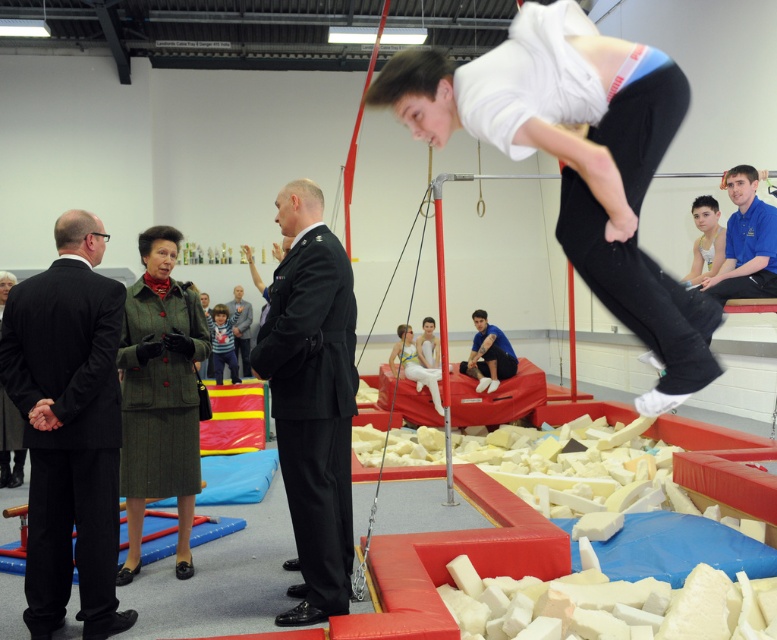
Who is more forward, [573,173] or [474,360]?

Point [573,173] is in front.

Who is more distant from viewer, (591, 22) or (474, 314)?

The point (474, 314) is more distant.

Where is `white matte gymnast at upper center`? This screenshot has height=640, width=777. white matte gymnast at upper center is located at coordinates (577, 161).

Which is in front, point (458, 112) or point (68, 520)?

Positioned in front is point (458, 112).

Between point (607, 170) and point (33, 477), which one is positioned behind?

Point (33, 477)

This screenshot has height=640, width=777. I want to click on white matte gymnast at upper center, so click(577, 161).

Can you confirm if black wool suit at left is taller than green wool coat at left?

Yes, black wool suit at left is taller than green wool coat at left.

Does black wool suit at left come behind green wool coat at left?

No, it is in front of green wool coat at left.

Where is `black wool suit at left`? This screenshot has height=640, width=777. black wool suit at left is located at coordinates (68, 428).

Where is `black wool suit at left`? black wool suit at left is located at coordinates (68, 428).